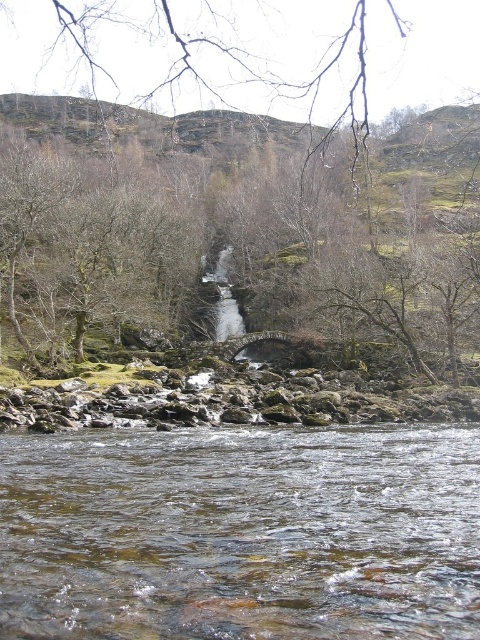
Question: Can you confirm if brown leafless tree at center is positioned to the right of clear water at center?

Choices:
 (A) yes
 (B) no

Answer: (B)

Question: Is brown leafless tree at center further to camera compared to clear water at center?

Choices:
 (A) yes
 (B) no

Answer: (A)

Question: Among these points, which one is nearest to the camera?

Choices:
 (A) click(213, 609)
 (B) click(435, 113)

Answer: (A)

Question: Is brown leafless tree at center positioned at the back of clear water at center?

Choices:
 (A) yes
 (B) no

Answer: (A)

Question: Among these points, which one is farthest from the camera?

Choices:
 (A) (260, 250)
 (B) (216, 448)

Answer: (A)